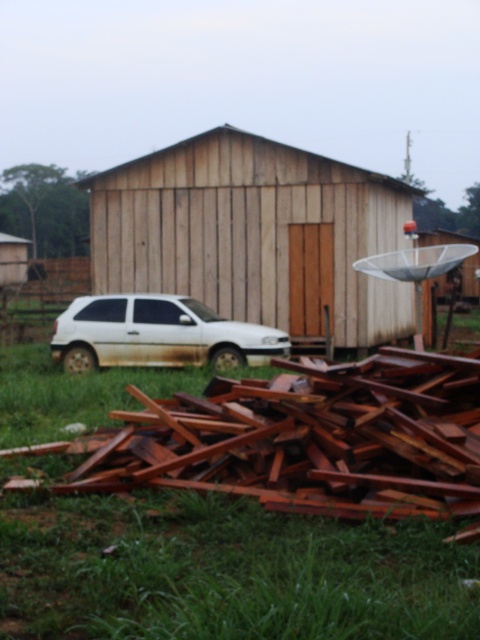
Does wooden planks at lower left appear under wooden satellite dish at right?

No.

Describe the element at coordinates (12, 260) in the screenshot. I see `wooden planks at lower left` at that location.

In order to click on wooden planks at lower left in this screenshot , I will do `click(12, 260)`.

Can you confirm if wooden at center is positioned to the left of wooden planks at lower left?

Incorrect, wooden at center is not on the left side of wooden planks at lower left.

Does wooden at center appear over wooden planks at lower left?

Incorrect, wooden at center is not positioned above wooden planks at lower left.

Who is more forward, (367, 234) or (24, 241)?

Point (367, 234)

Locate an element on the screen. wooden at center is located at coordinates (254, 236).

Does wooden at center have a lesser width compared to wooden satellite dish at right?

No.

Can you confirm if wooden at center is positioned to the right of wooden satellite dish at right?

Incorrect, wooden at center is not on the right side of wooden satellite dish at right.

Between point (148, 168) and point (445, 237), which one is positioned behind?

The point (445, 237) is more distant.

Find the location of a particular element. This screenshot has height=640, width=480. wooden at center is located at coordinates (254, 236).